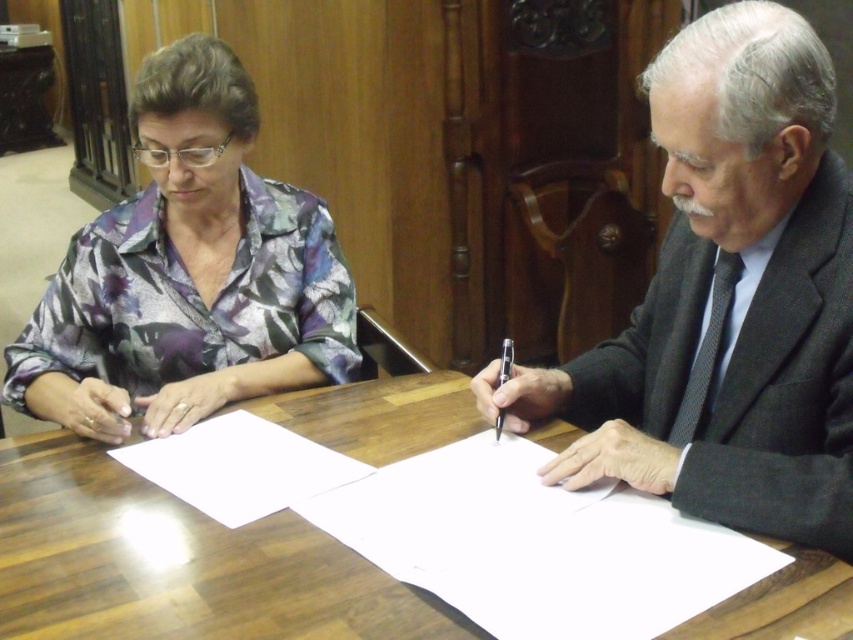
You are organizing a small meeting in an office and need to place a dark gray suit at center and a black plastic pen at center on a shelf. The shelf has limited space. Which item should you place first to ensure both fit?

Since the dark gray suit at center is bigger than the black plastic pen at center, you should place the dark gray suit at center first to ensure both items fit on the shelf.

Based on the scene description, can you determine the spatial relationship between the dark gray suit at center and the floral fabric blouse at left?

The dark gray suit at center is to the right of the floral fabric blouse at left.

You are an interior designer planning to place a large decorative vase between the dark gray suit at center and the floral fabric blouse at left. Considering their sizes, which object should the vase be placed closer to?

The dark gray suit at center has a smaller size compared to the floral fabric blouse at left, so the vase should be placed closer to the floral fabric blouse at left to balance the sizes.